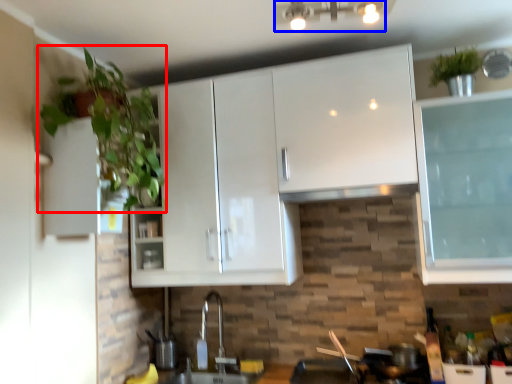
Question: Among these objects, which one is nearest to the camera, houseplant (highlighted by a red box) or light fixture (highlighted by a blue box)?

Choices:
 (A) houseplant
 (B) light fixture

Answer: (B)